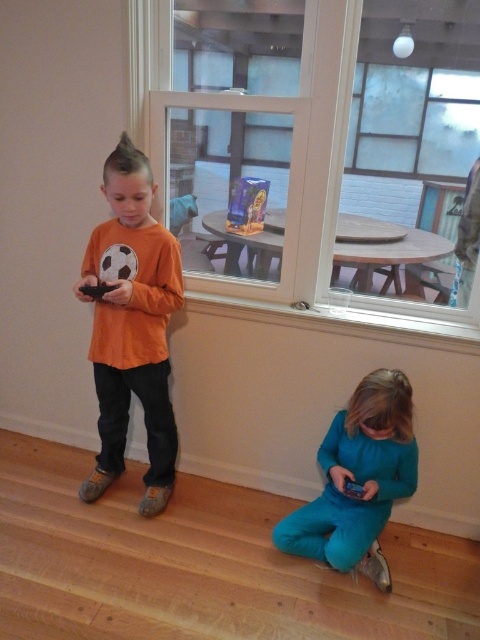
Question: Which is farther from the clear glass window at upper center?

Choices:
 (A) teal fabric pants at lower center
 (B) orange matte shirt at center

Answer: (A)

Question: Does orange matte shirt at center have a lesser width compared to clear glass window at upper center?

Choices:
 (A) yes
 (B) no

Answer: (A)

Question: Among these objects, which one is nearest to the camera?

Choices:
 (A) teal fabric pants at lower center
 (B) orange matte shirt at center
 (C) clear glass window at upper center

Answer: (A)

Question: Which object appears farthest from the camera in this image?

Choices:
 (A) teal fabric pants at lower center
 (B) orange matte shirt at center

Answer: (B)

Question: Does orange matte shirt at center have a greater width compared to clear glass window at upper center?

Choices:
 (A) no
 (B) yes

Answer: (A)

Question: Is orange matte shirt at center bigger than clear glass window at upper center?

Choices:
 (A) no
 (B) yes

Answer: (A)